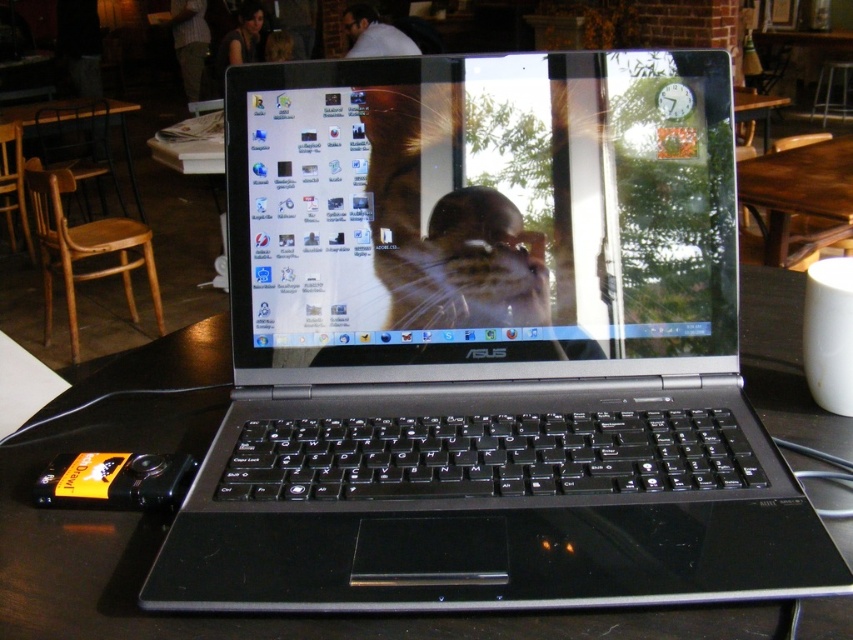
Does black plastic laptop at center appear over shiny fur cat at center?

No, black plastic laptop at center is not above shiny fur cat at center.

Is point (596, 593) behind point (425, 104)?

No, it is in front of (425, 104).

Identify the location of black plastic laptop at center. This screenshot has width=853, height=640. (486, 348).

Can you confirm if satin black laptop at center is smaller than shiny fur cat at center?

Actually, satin black laptop at center might be larger than shiny fur cat at center.

Between point (413, 189) and point (531, 275), which one is positioned behind?

The point (531, 275) is behind.

Locate an element on the screen. Image resolution: width=853 pixels, height=640 pixels. satin black laptop at center is located at coordinates (480, 209).

Which of these two, shiny fur cat at center or brown wooden table at center, stands shorter?

shiny fur cat at center

Does shiny fur cat at center appear on the right side of brown wooden table at center?

In fact, shiny fur cat at center is to the left of brown wooden table at center.

Between point (392, 141) and point (795, 262), which one is positioned in front?

Point (392, 141) is in front.

The image size is (853, 640). I want to click on shiny fur cat at center, so click(x=445, y=227).